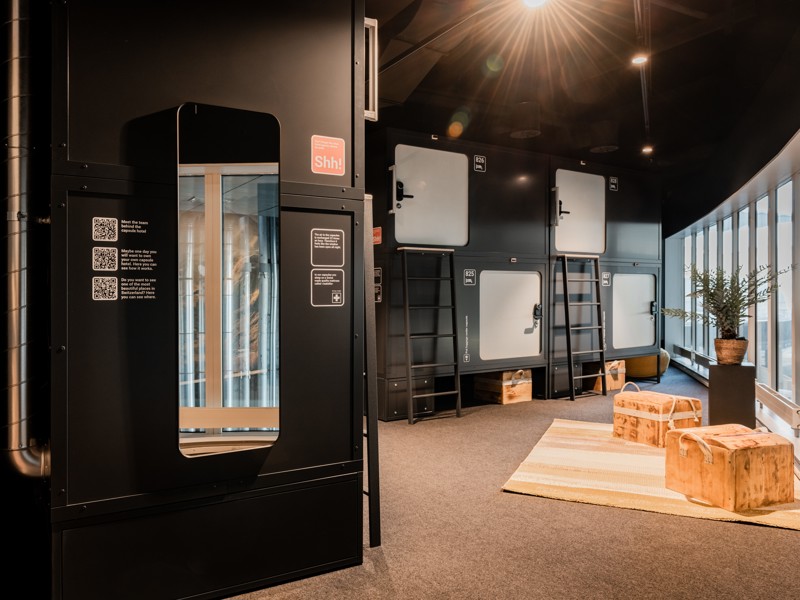
Identify the location of plant. (734, 315).